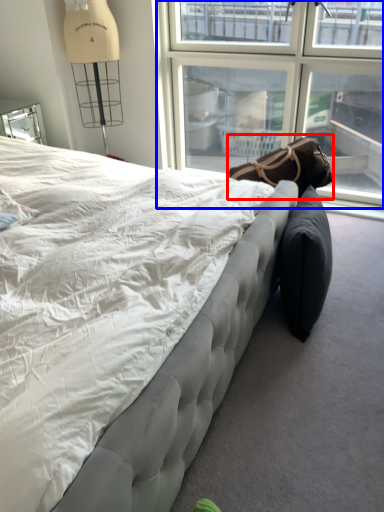
Question: Which point is further to the camera, bean bag chair (highlighted by a red box) or window (highlighted by a blue box)?

Choices:
 (A) bean bag chair
 (B) window

Answer: (B)